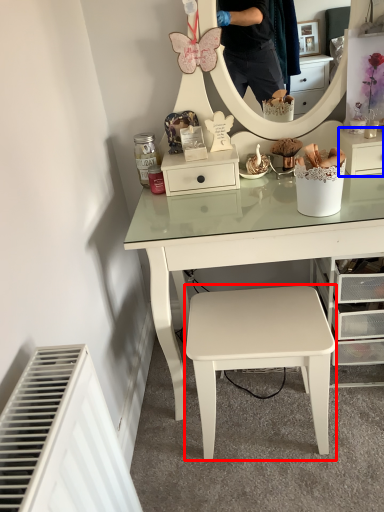
Question: Which object is closer to the camera taking this photo, stool (highlighted by a red box) or shelf (highlighted by a blue box)?

Choices:
 (A) stool
 (B) shelf

Answer: (A)